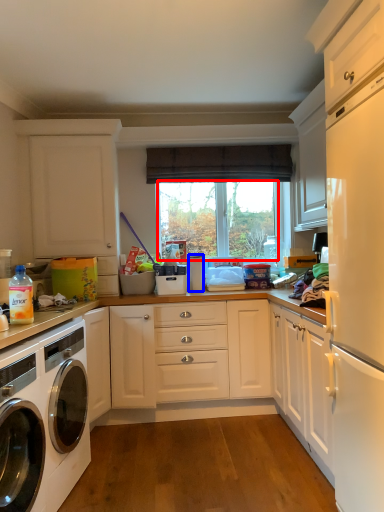
Question: Which point is closer to the camera, window screen (highlighted by a red box) or appliance (highlighted by a blue box)?

Choices:
 (A) window screen
 (B) appliance

Answer: (B)